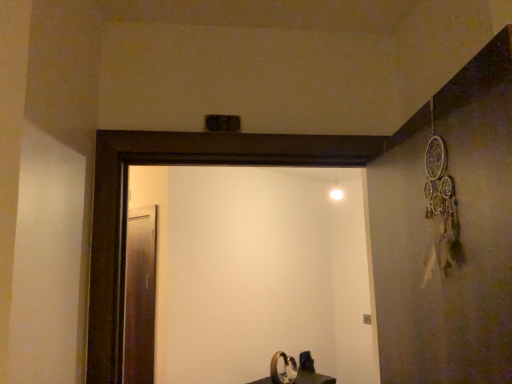
Question: Considering the relative sizes of transparent glass screen door at left, which appears as the first screen door when viewed from the back, and white glossy screen door at center, which is the 1th screen door from right to left, in the image provided, is transparent glass screen door at left, which appears as the first screen door when viewed from the back, shorter than white glossy screen door at center, which is the 1th screen door from right to left,?

Choices:
 (A) yes
 (B) no

Answer: (B)

Question: Considering the relative sizes of transparent glass screen door at left, which is counted as the second screen door, starting from the front, and white glossy screen door at center, acting as the second screen door starting from the back, in the image provided, is transparent glass screen door at left, which is counted as the second screen door, starting from the front, smaller than white glossy screen door at center, acting as the second screen door starting from the back,?

Choices:
 (A) no
 (B) yes

Answer: (B)

Question: Is transparent glass screen door at left, which appears as the first screen door when viewed from the back, not within white glossy screen door at center, acting as the second screen door starting from the back?

Choices:
 (A) yes
 (B) no

Answer: (A)

Question: Can you confirm if transparent glass screen door at left, which appears as the first screen door when viewed from the back, is taller than white glossy screen door at center, which is the second screen door in left-to-right order?

Choices:
 (A) no
 (B) yes

Answer: (B)

Question: Can you confirm if transparent glass screen door at left, which is counted as the second screen door, starting from the front, is positioned to the left of white glossy screen door at center, positioned as the 1th screen door in front-to-back order?

Choices:
 (A) yes
 (B) no

Answer: (A)

Question: Is transparent glass screen door at left, positioned as the first screen door in left-to-right order, far away from white glossy screen door at center, acting as the second screen door starting from the back?

Choices:
 (A) no
 (B) yes

Answer: (A)

Question: Considering the relative sizes of transparent glass screen door at left, which is counted as the second screen door, starting from the front, and matte black sink at lower center in the image provided, is transparent glass screen door at left, which is counted as the second screen door, starting from the front, thinner than matte black sink at lower center?

Choices:
 (A) no
 (B) yes

Answer: (B)

Question: Is transparent glass screen door at left, positioned as the first screen door in left-to-right order, to the left of matte black sink at lower center from the viewer's perspective?

Choices:
 (A) yes
 (B) no

Answer: (A)

Question: Is transparent glass screen door at left, which is counted as the second screen door, starting from the front, turned away from matte black sink at lower center?

Choices:
 (A) no
 (B) yes

Answer: (A)

Question: Can you confirm if transparent glass screen door at left, which appears as the first screen door when viewed from the back, is positioned to the right of matte black sink at lower center?

Choices:
 (A) yes
 (B) no

Answer: (B)

Question: From the image's perspective, would you say transparent glass screen door at left, the second screen door in the right-to-left sequence, is shown under matte black sink at lower center?

Choices:
 (A) yes
 (B) no

Answer: (B)

Question: Is transparent glass screen door at left, which is counted as the second screen door, starting from the front, smaller than matte black sink at lower center?

Choices:
 (A) yes
 (B) no

Answer: (A)

Question: Is matte black sink at lower center smaller than transparent glass screen door at left, which appears as the first screen door when viewed from the back?

Choices:
 (A) yes
 (B) no

Answer: (B)